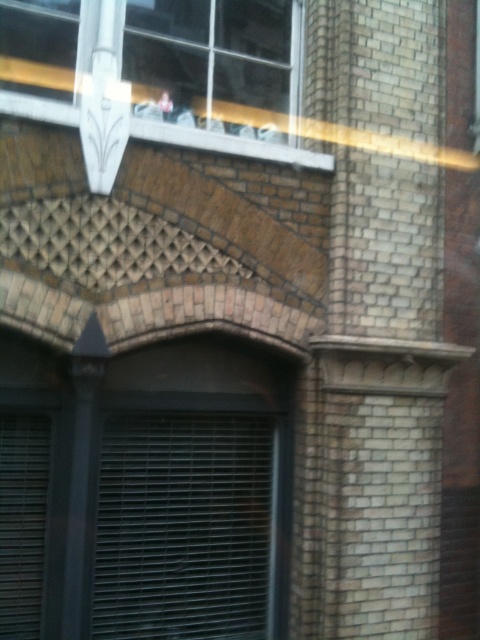
Question: Which of the following is the farthest from the observer?

Choices:
 (A) clear glass window at upper center
 (B) white textured stone at upper center

Answer: (A)

Question: Is clear glass window at upper center thinner than white textured stone at upper center?

Choices:
 (A) no
 (B) yes

Answer: (B)

Question: Among these points, which one is nearest to the camera?

Choices:
 (A) (276, 154)
 (B) (216, 44)

Answer: (A)

Question: Can you confirm if clear glass window at upper center is positioned below white textured stone at upper center?

Choices:
 (A) no
 (B) yes

Answer: (A)

Question: Is clear glass window at upper center above white textured stone at upper center?

Choices:
 (A) no
 (B) yes

Answer: (B)